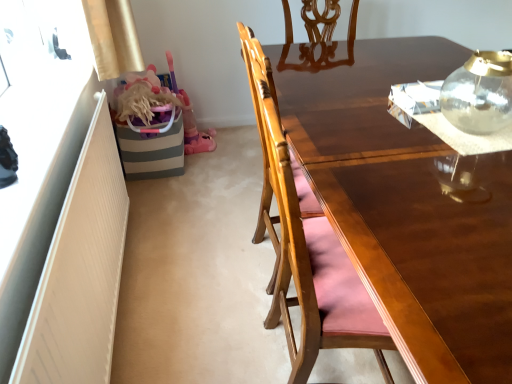
Question: Relative to wooden chair at center, is transparent glass teapot at upper right in front or behind?

Choices:
 (A) front
 (B) behind

Answer: (A)

Question: In terms of width, does transparent glass teapot at upper right look wider or thinner when compared to wooden chair at center?

Choices:
 (A) thin
 (B) wide

Answer: (A)

Question: Does point (465, 86) appear closer or farther from the camera than point (287, 162)?

Choices:
 (A) farther
 (B) closer

Answer: (A)

Question: From a real-world perspective, is wooden chair at center above or below transparent glass teapot at upper right?

Choices:
 (A) above
 (B) below

Answer: (B)

Question: Looking at their shapes, would you say wooden chair at center is wider or thinner than transparent glass teapot at upper right?

Choices:
 (A) wide
 (B) thin

Answer: (A)

Question: Relative to transparent glass teapot at upper right, is wooden chair at center in front or behind?

Choices:
 (A) behind
 (B) front

Answer: (A)

Question: Is wooden chair at center taller or shorter than transparent glass teapot at upper right?

Choices:
 (A) tall
 (B) short

Answer: (A)